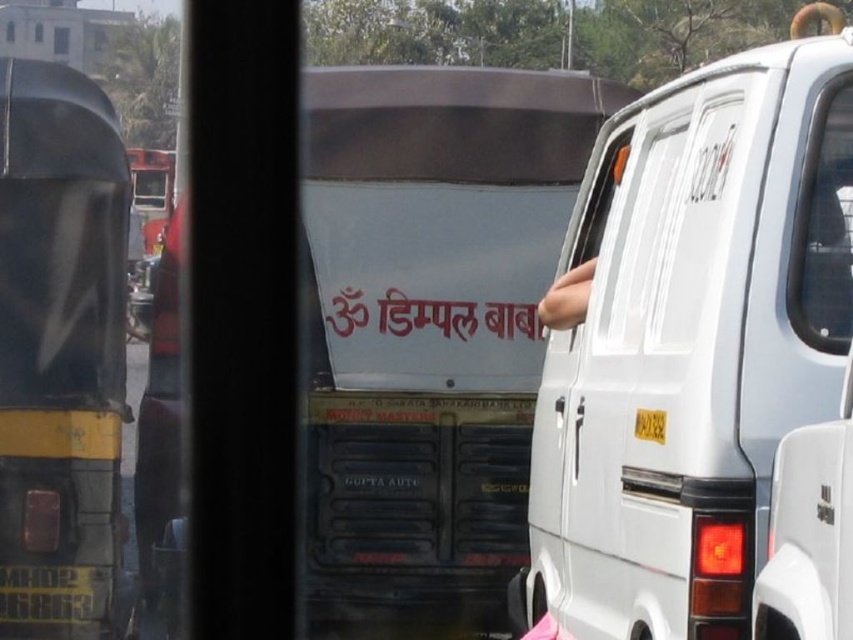
Question: Observing the image, what is the correct spatial positioning of white matte van at center in reference to yellow matte truck at left?

Choices:
 (A) right
 (B) left

Answer: (A)

Question: Is white matte van at center thinner than yellow matte truck at left?

Choices:
 (A) yes
 (B) no

Answer: (A)

Question: Which point is closer to the camera?

Choices:
 (A) (619, 349)
 (B) (10, 577)
 (C) (45, 609)

Answer: (A)

Question: In this image, where is white matte van at center located relative to yellow matte truck at left?

Choices:
 (A) above
 (B) below

Answer: (B)

Question: Which object is farther from the camera taking this photo?

Choices:
 (A) white matte van at center
 (B) yellow metallic license plate at lower left

Answer: (B)

Question: Which object is the closest to the white matte van at center?

Choices:
 (A) yellow metallic license plate at lower left
 (B) yellow matte truck at left

Answer: (A)